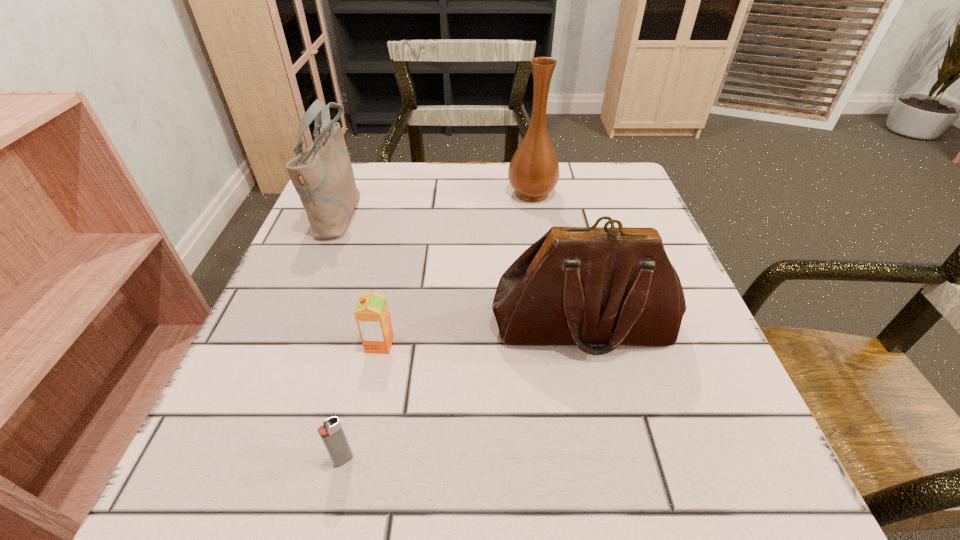
Find the location of a particular element. The width and height of the screenshot is (960, 540). vacant position located on the front of the fourth tallest object is located at coordinates click(x=367, y=404).

Image resolution: width=960 pixels, height=540 pixels. What are the coordinates of `free space located on the right of the nearest object` in the screenshot? It's located at (391, 460).

The width and height of the screenshot is (960, 540). What are the coordinates of `vase that is at the far edge` in the screenshot? It's located at click(533, 172).

Identify the location of shoulder bag at the far edge. The width and height of the screenshot is (960, 540). (322, 175).

Locate an element on the screen. object at the near edge is located at coordinates (331, 432).

Where is `object that is at the left edge`? The height and width of the screenshot is (540, 960). object that is at the left edge is located at coordinates (322, 175).

This screenshot has width=960, height=540. In order to click on object present at the right edge in this screenshot , I will do `click(584, 286)`.

Find the location of a particular element. This screenshot has width=960, height=540. object positioned at the far left corner is located at coordinates [x=322, y=175].

Find the location of a particular element. The width and height of the screenshot is (960, 540). vacant space at the far edge is located at coordinates (534, 203).

Where is `free space at the left edge of the desktop`? This screenshot has width=960, height=540. free space at the left edge of the desktop is located at coordinates (358, 265).